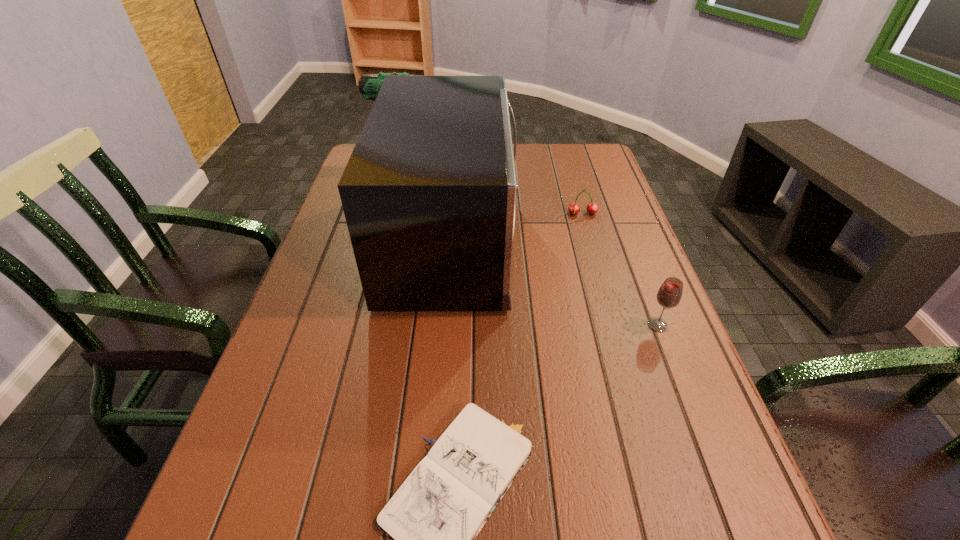
Locate an element on the screen. The height and width of the screenshot is (540, 960). microwave oven is located at coordinates tap(429, 192).

At what (x,y) coordinates should I click in order to perform the action: click on drill. Please return your answer as a coordinate pair (x, y). Image resolution: width=960 pixels, height=540 pixels. Looking at the image, I should click on (369, 85).

Find the location of a particular element. the fourth shortest object is located at coordinates (369, 85).

In order to click on the fourth farthest object in this screenshot , I will do `click(669, 295)`.

Locate an element on the screen. The image size is (960, 540). glass drink container is located at coordinates (669, 295).

What are the coordinates of `cherry` in the screenshot? It's located at (574, 208).

What are the coordinates of `the fourth object from left to right` in the screenshot? It's located at (574, 208).

Locate an element on the screen. Image resolution: width=960 pixels, height=540 pixels. vacant space located 0.190m with the door open on the tallest object is located at coordinates (588, 239).

The width and height of the screenshot is (960, 540). I want to click on free space located 0.310m on the handle side of the drill, so click(556, 155).

Image resolution: width=960 pixels, height=540 pixels. What are the coordinates of `free spot located on the back of the rightmost object` in the screenshot? It's located at (620, 229).